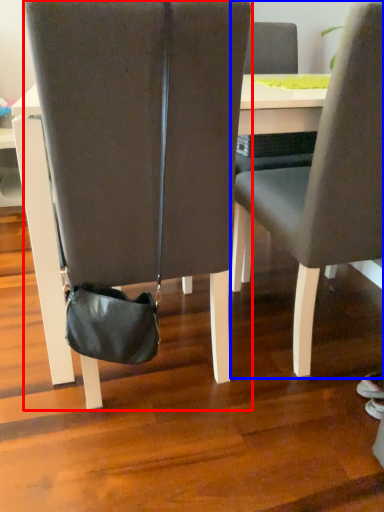
Question: Which point is closer to the camera, chair (highlighted by a red box) or chair (highlighted by a blue box)?

Choices:
 (A) chair
 (B) chair

Answer: (A)